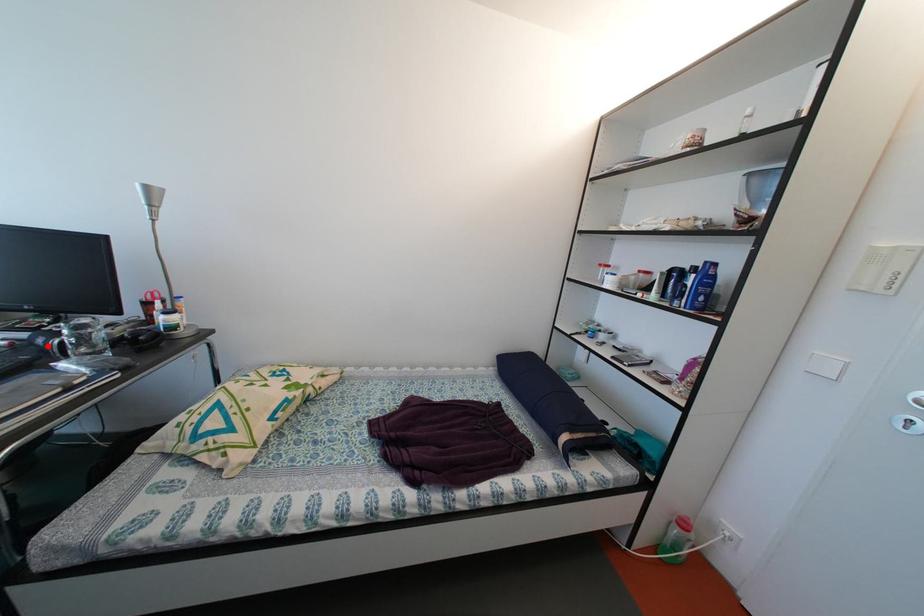
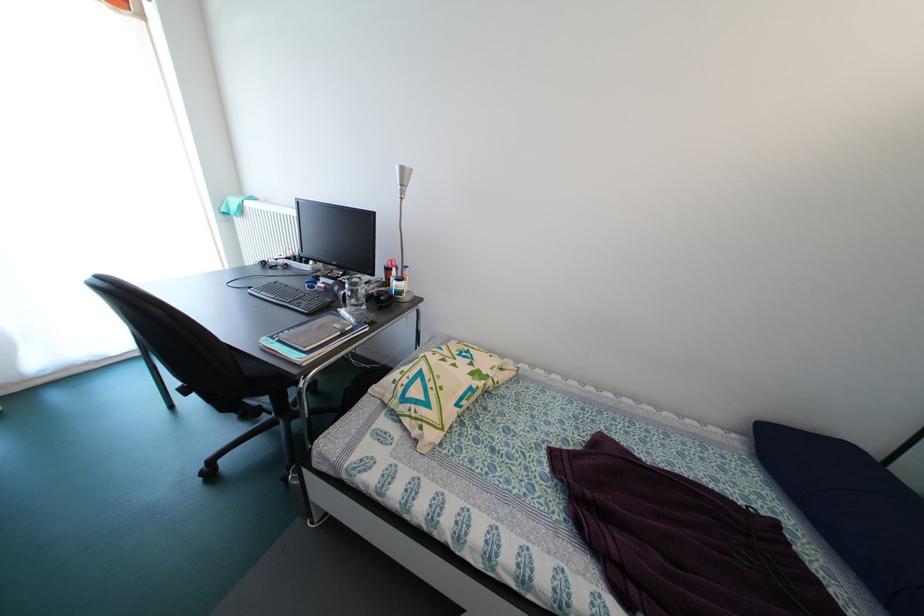
The point at the highlighted location is marked in the first image. Where is the corresponding point in the second image?

(344, 294)